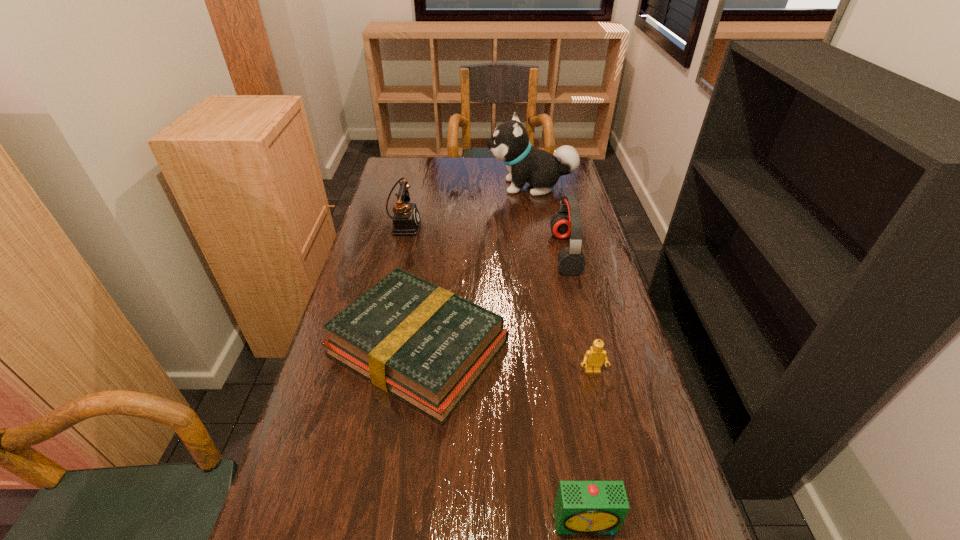
This screenshot has height=540, width=960. In order to click on the farthest object in this screenshot , I will do `click(509, 143)`.

I want to click on the tallest object, so [x=509, y=143].

The image size is (960, 540). In order to click on the second tallest object in this screenshot , I will do `click(567, 222)`.

Where is `the fourth shortest object`? Image resolution: width=960 pixels, height=540 pixels. the fourth shortest object is located at coordinates (406, 219).

Where is `alarm clock`? alarm clock is located at coordinates click(x=581, y=507).

Identify the location of Lego. (594, 357).

Where is `hardback book`? This screenshot has width=960, height=540. hardback book is located at coordinates tap(421, 343).

This screenshot has width=960, height=540. Identify the location of free space located 0.210m at the face of the farthest object. (432, 186).

This screenshot has width=960, height=540. Find the location of `vacant space located at the face of the farthest object`. vacant space located at the face of the farthest object is located at coordinates (403, 186).

Locate an element on the screen. vacant area located at the face of the farthest object is located at coordinates pos(417,186).